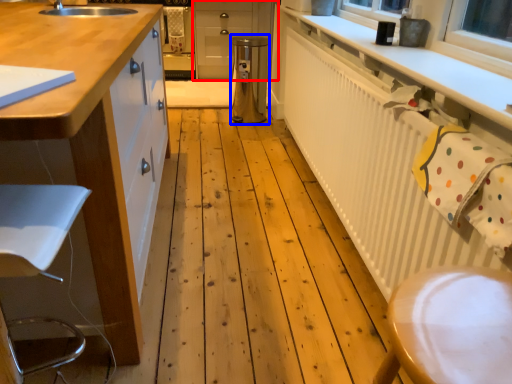
Question: Among these objects, which one is nearest to the camera, cabinetry (highlighted by a red box) or appliance (highlighted by a blue box)?

Choices:
 (A) cabinetry
 (B) appliance

Answer: (B)